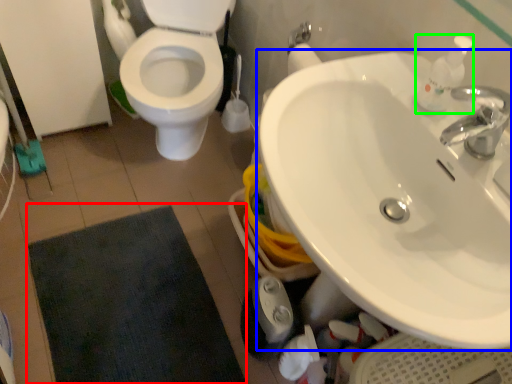
Question: Considering the real-world distances, which object is farthest from bath mat (highlighted by a red box)? sink (highlighted by a blue box) or soap dispenser (highlighted by a green box)?

Choices:
 (A) sink
 (B) soap dispenser

Answer: (B)